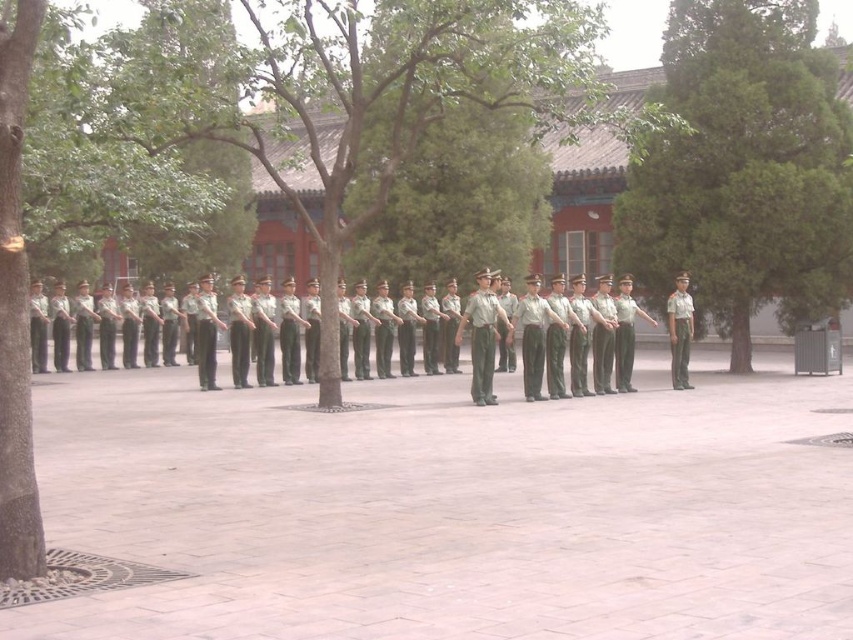
Does light gray uniform at center come behind light gray fabric uniform at center?

No, light gray uniform at center is in front of light gray fabric uniform at center.

Is light gray uniform at center wider than light gray fabric uniform at center?

Yes.

Is point (488, 353) less distant than point (674, 323)?

Yes, it is.

Where is `light gray uniform at center`? This screenshot has width=853, height=640. light gray uniform at center is located at coordinates (482, 337).

Based on the photo, does green leafy tree at left lie behind light gray uniform at center?

No, green leafy tree at left is in front of light gray uniform at center.

Which of these two, green leafy tree at left or light gray uniform at center, stands taller?

With more height is light gray uniform at center.

Locate an element on the screen. The height and width of the screenshot is (640, 853). green leafy tree at left is located at coordinates (15, 304).

How distant is green leafy tree at left from green uniform at center?

green leafy tree at left is 43.77 feet away from green uniform at center.

Does green leafy tree at left have a greater height compared to green uniform at center?

No, green leafy tree at left is not taller than green uniform at center.

Does point (24, 42) come behind point (479, 356)?

That is False.

This screenshot has height=640, width=853. What are the coordinates of `green leafy tree at left` in the screenshot? It's located at (x=15, y=304).